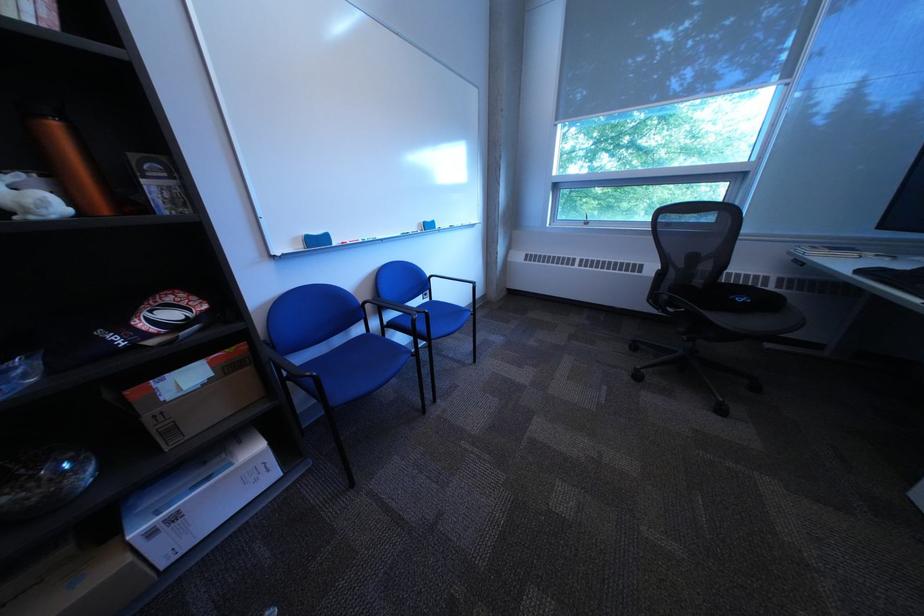
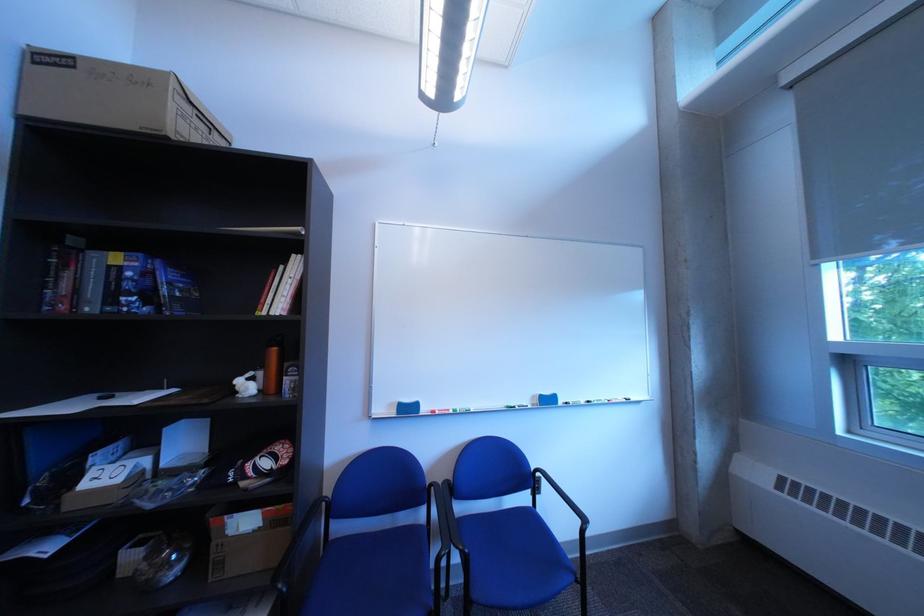
Find the pixel in the second image that matches (310,241) in the first image.

(406, 407)